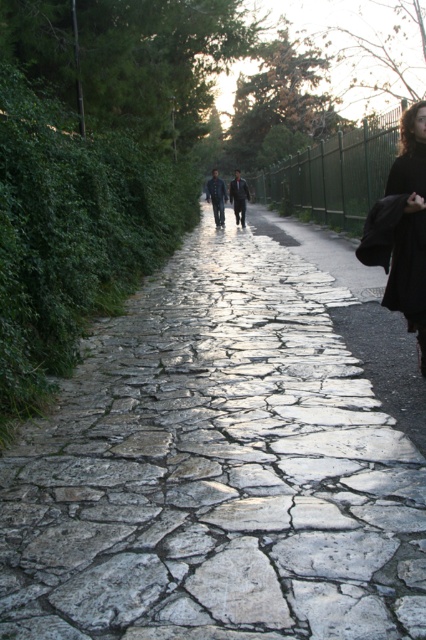
Question: Can you confirm if cracked stone pavement at center is smaller than dark blue jeans at center?

Choices:
 (A) no
 (B) yes

Answer: (B)

Question: Which of the following is the farthest from the observer?

Choices:
 (A) cracked stone pavement at center
 (B) dark blue jeans at center
 (C) black matte dress at right

Answer: (B)

Question: Which object appears closest to the camera in this image?

Choices:
 (A) black matte dress at right
 (B) black wool coat at right
 (C) dark blue jeans at center

Answer: (A)

Question: Considering the relative positions of cracked stone pavement at center and black matte dress at right in the image provided, where is cracked stone pavement at center located with respect to black matte dress at right?

Choices:
 (A) right
 (B) left

Answer: (B)

Question: Estimate the real-world distances between objects in this image. Which object is closer to the cracked stone pavement at center?

Choices:
 (A) black wool coat at right
 (B) black matte dress at right
 (C) dark blue jeans at center

Answer: (B)

Question: In this image, where is black wool coat at right located relative to black matte dress at right?

Choices:
 (A) above
 (B) below

Answer: (A)